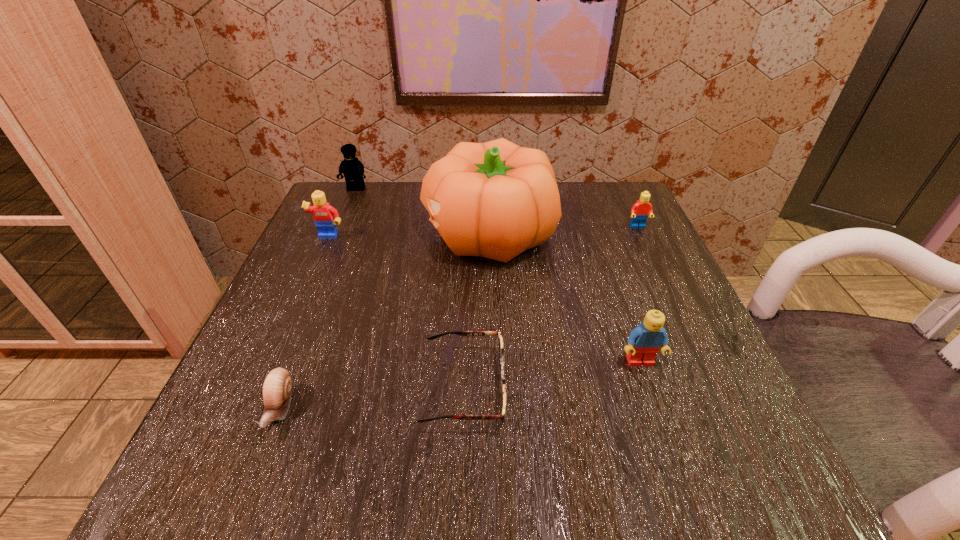
Where is `vacant area that lies between the spectacles and the farthest object`? vacant area that lies between the spectacles and the farthest object is located at coordinates (410, 288).

You are a GUI agent. You are given a task and a screenshot of the screen. Output one action in this format:
    pyautogui.click(x=<x>, y=<y>)
    Task: Click on the blank region between the farthest Lego and the third farthest Lego
    This screenshot has width=960, height=540.
    Given the screenshot: What is the action you would take?
    pyautogui.click(x=342, y=213)

Locate an element on the screen. free space between the rightmost object and the escargot is located at coordinates (459, 318).

Where is `free space between the shortest object and the shortest Lego`? free space between the shortest object and the shortest Lego is located at coordinates (551, 307).

This screenshot has width=960, height=540. Find the location of `empty location between the third shortest object and the pumpkin`. empty location between the third shortest object and the pumpkin is located at coordinates click(x=564, y=230).

Locate an element on the screen. Image resolution: width=960 pixels, height=540 pixels. vacant area that lies between the spectacles and the third farthest Lego is located at coordinates (396, 313).

Where is `empty location between the escargot and the tallest object`? This screenshot has height=540, width=960. empty location between the escargot and the tallest object is located at coordinates (384, 321).

The width and height of the screenshot is (960, 540). What are the coordinates of `empty space that is in between the rightmost object and the sixth object from left to right` in the screenshot? It's located at (639, 294).

This screenshot has width=960, height=540. Identify the location of vacant area between the second object from right to left and the second farthest Lego. (639, 294).

Identify the location of vacant space that's between the farthest Lego and the pumpkin. (422, 211).